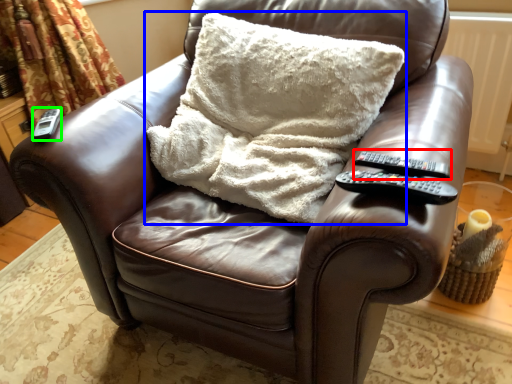
Question: Which object is the farthest from remote (highlighted by a red box)? Choose among these: pillow (highlighted by a blue box) or remote (highlighted by a green box).

Choices:
 (A) pillow
 (B) remote

Answer: (B)